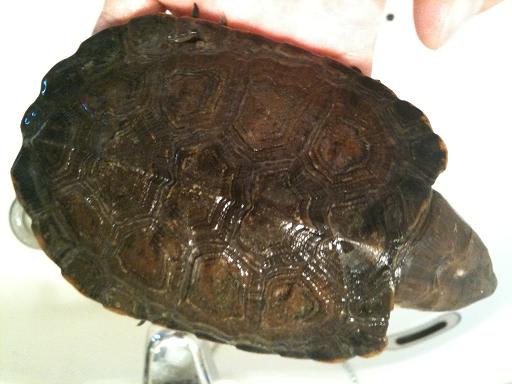
At what (x,y) coordinates should I click in order to perform the action: click on sink. Please return your answer as a coordinate pair (x, y). Looking at the image, I should click on (x=21, y=225).